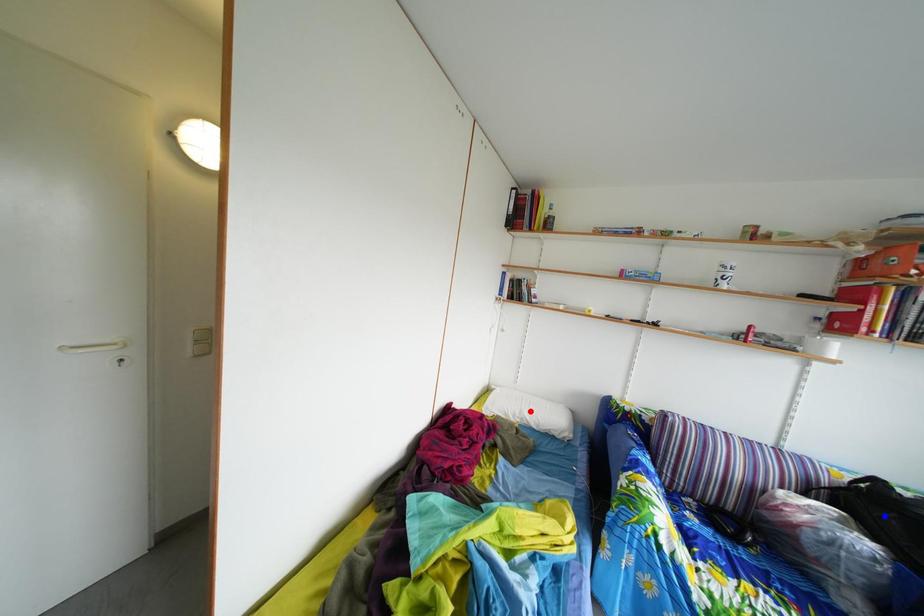
Question: In the image, two points are highlighted. Which point is nearer to the camera? Reply with the corresponding letter.

Choices:
 (A) blue point
 (B) red point

Answer: (A)